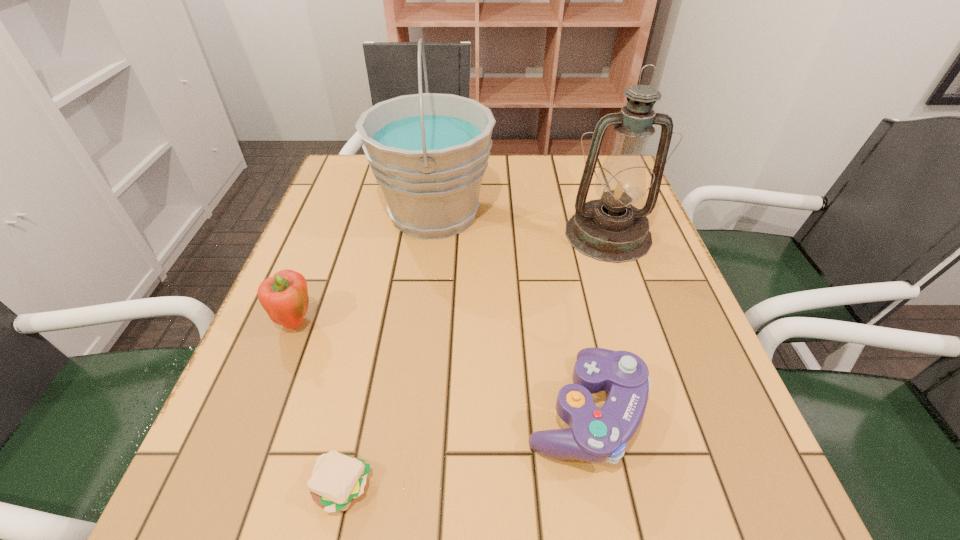
Where is `bucket`? The width and height of the screenshot is (960, 540). bucket is located at coordinates (428, 152).

Where is `oil lamp`? This screenshot has height=540, width=960. oil lamp is located at coordinates (610, 229).

This screenshot has height=540, width=960. I want to click on the third nearest object, so click(x=284, y=297).

Where is `pepper`? The height and width of the screenshot is (540, 960). pepper is located at coordinates (284, 297).

At what (x,y) coordinates should I click in order to perform the action: click on the fourth tallest object. Please return your answer as a coordinate pair (x, y). Looking at the image, I should click on (595, 435).

Find the location of a particular element. patty is located at coordinates (337, 479).

You are a GUI agent. You are given a task and a screenshot of the screen. Output one action in this format:
    pyautogui.click(x=<x>, y=<y>)
    Task: Click on the blank space located on the right of the bucket
    
    Given the screenshot: What is the action you would take?
    pyautogui.click(x=626, y=213)

Image resolution: width=960 pixels, height=540 pixels. Find the location of `vacant space situated 0.240m on the back of the oil lamp`. vacant space situated 0.240m on the back of the oil lamp is located at coordinates (584, 163).

At what (x,y) coordinates should I click in order to perform the action: click on free space located 0.220m on the back of the leftmost object. Please return your answer as a coordinate pair (x, y). The width and height of the screenshot is (960, 540). Looking at the image, I should click on (328, 238).

Identify the location of vacant space positioned 0.280m on the back of the fourth tallest object. (556, 256).